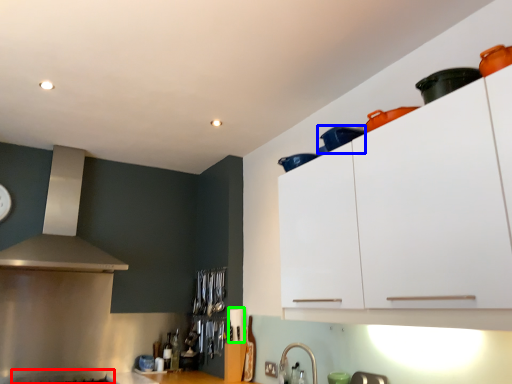
Question: Which object is positioned farthest from gas stove (highlighted by a red box)? Select from appliance (highlighted by a blue box) and appliance (highlighted by a green box).

Choices:
 (A) appliance
 (B) appliance

Answer: (A)